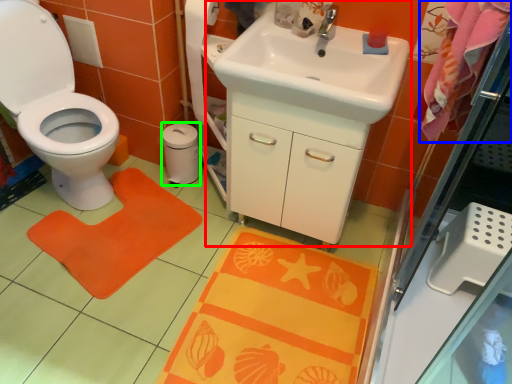
Question: Estimate the real-world distances between objects in this image. Which object is farther from sink (highlighted by a red box), beach towel (highlighted by a blue box) or toilet paper (highlighted by a green box)?

Choices:
 (A) beach towel
 (B) toilet paper

Answer: (B)